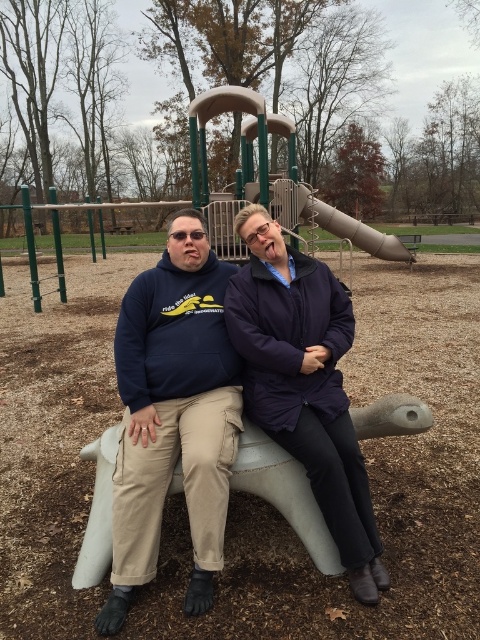
Question: Which of the following is the closest to the observer?

Choices:
 (A) matte blue hoodie at center
 (B) navy blue hoodie at center

Answer: (A)

Question: Can you confirm if matte blue hoodie at center is smaller than navy blue hoodie at center?

Choices:
 (A) yes
 (B) no

Answer: (B)

Question: Observing the image, what is the correct spatial positioning of matte blue hoodie at center in reference to navy blue hoodie at center?

Choices:
 (A) above
 (B) below

Answer: (A)

Question: Does matte blue hoodie at center appear on the left side of navy blue hoodie at center?

Choices:
 (A) yes
 (B) no

Answer: (B)

Question: Among these objects, which one is farthest from the camera?

Choices:
 (A) navy blue hoodie at center
 (B) matte blue hoodie at center

Answer: (A)